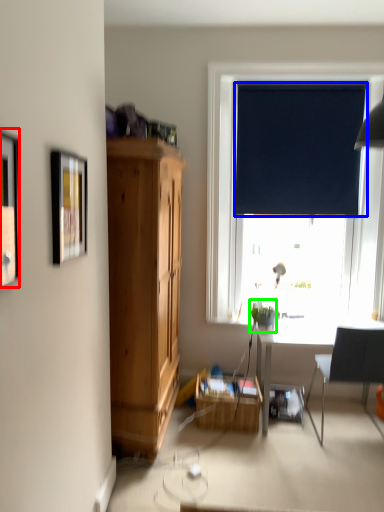
Question: Considering the real-world distances, which object is farthest from picture frame (highlighted by a red box)? curtain (highlighted by a blue box) or houseplant (highlighted by a green box)?

Choices:
 (A) curtain
 (B) houseplant

Answer: (A)